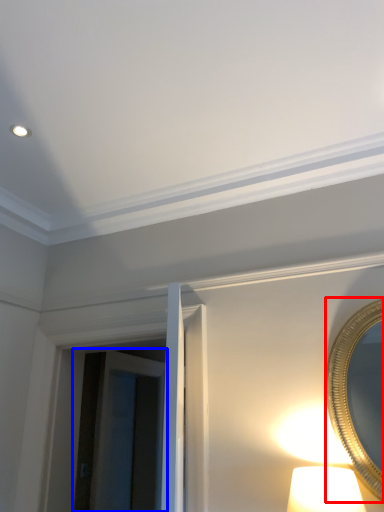
Question: Which of the following is the farthest to the observer, mirror (highlighted by a red box) or glass door (highlighted by a blue box)?

Choices:
 (A) mirror
 (B) glass door

Answer: (B)